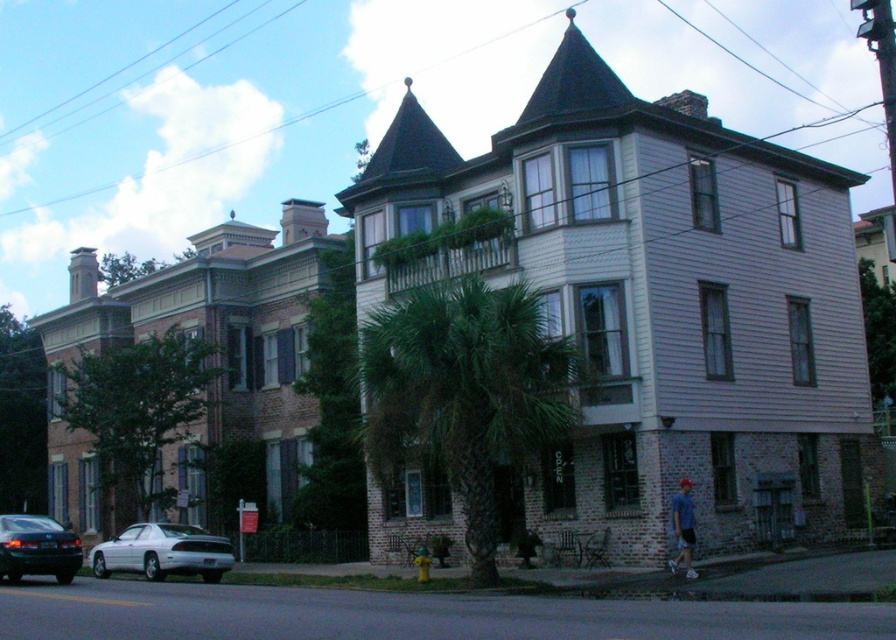
Question: Can you confirm if green leafy palm tree at center is positioned below blue cotton shirt at lower right?

Choices:
 (A) yes
 (B) no

Answer: (B)

Question: Is green leafy palm tree at center to the left of white glossy car at lower left from the viewer's perspective?

Choices:
 (A) yes
 (B) no

Answer: (B)

Question: Estimate the real-world distances between objects in this image. Which object is closer to the white glossy car at lower left?

Choices:
 (A) shiny black sedan at lower left
 (B) blue cotton shirt at lower right
 (C) green leafy palm tree at center

Answer: (A)

Question: Where is green leafy palm tree at center located in relation to white glossy car at lower left in the image?

Choices:
 (A) above
 (B) below

Answer: (A)

Question: Considering the real-world distances, which object is farthest from the shiny black sedan at lower left?

Choices:
 (A) green leafy palm tree at center
 (B) blue cotton shirt at lower right
 (C) white glossy car at lower left

Answer: (B)

Question: Which of the following is the closest to the observer?

Choices:
 (A) (134, 548)
 (B) (674, 520)
 (C) (27, 556)

Answer: (C)